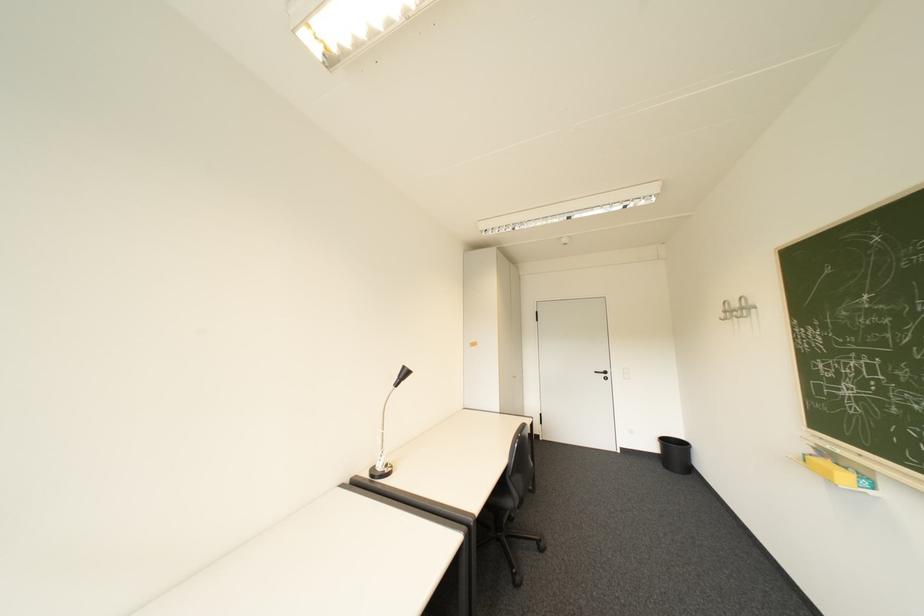
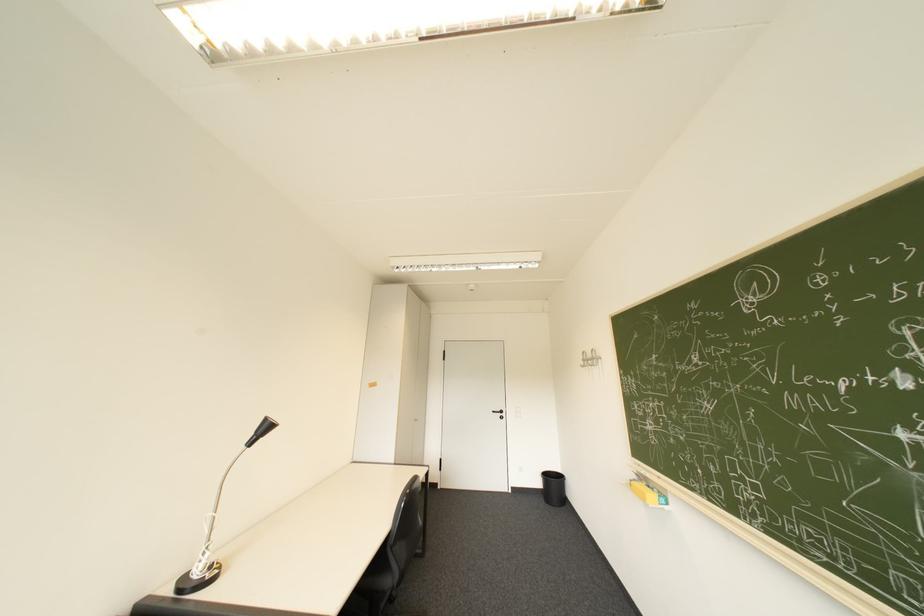
In the second image, find the point that corresponds to point (529, 435) in the first image.

(419, 491)